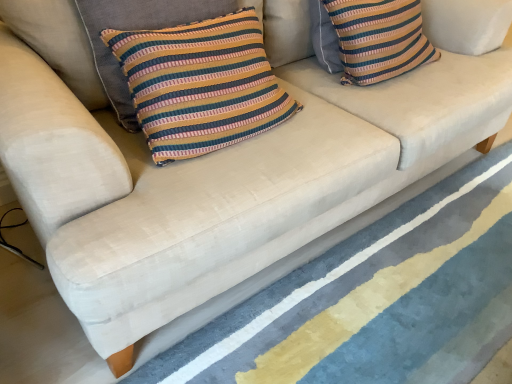
Question: Considering the relative positions of striped fabric pillow at upper right, marked as the second pillow in a front-to-back arrangement, and textured blue rug at lower center in the image provided, is striped fabric pillow at upper right, marked as the second pillow in a front-to-back arrangement, to the left or to the right of textured blue rug at lower center?

Choices:
 (A) right
 (B) left

Answer: (B)

Question: In the image, is striped fabric pillow at upper right, arranged as the 1th pillow when viewed from the right, positioned in front of or behind textured blue rug at lower center?

Choices:
 (A) behind
 (B) front

Answer: (A)

Question: Which of these objects is positioned farthest from the striped fabric pillow at center, the second pillow positioned from the right?

Choices:
 (A) textured blue rug at lower center
 (B) striped fabric pillow at upper right, arranged as the 1th pillow when viewed from the right

Answer: (A)

Question: Estimate the real-world distances between objects in this image. Which object is farther from the striped fabric pillow at upper right, the first pillow when ordered from back to front?

Choices:
 (A) textured blue rug at lower center
 (B) striped fabric pillow at center, placed as the 2th pillow when sorted from back to front

Answer: (A)